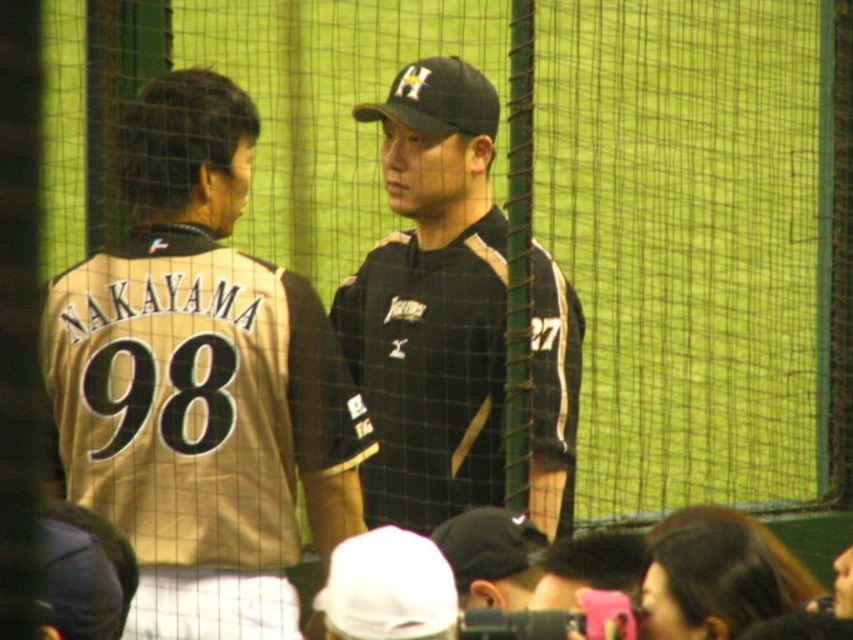
Is gold jersey at left thinner than black matte uniform at center?

No.

Consider the image. Is gold jersey at left wider than black matte uniform at center?

Yes.

Is point (141, 170) more distant than point (421, 294)?

No, (141, 170) is closer to viewer.

Find the location of a particular element. gold jersey at left is located at coordinates (201, 381).

Can you confirm if black matte uniform at center is smaller than black matte baseball cap at center?

Incorrect, black matte uniform at center is not smaller in size than black matte baseball cap at center.

The image size is (853, 640). Identify the location of black matte uniform at center. (431, 301).

You are a GUI agent. You are given a task and a screenshot of the screen. Output one action in this format:
    pyautogui.click(x=<x>, y=<y>)
    Task: Click on the black matte uniform at center
    
    Given the screenshot: What is the action you would take?
    pyautogui.click(x=431, y=301)

Does gold jersey at left have a larger size compared to black matte baseball cap at center?

Correct, gold jersey at left is larger in size than black matte baseball cap at center.

The height and width of the screenshot is (640, 853). What do you see at coordinates (201, 381) in the screenshot?
I see `gold jersey at left` at bounding box center [201, 381].

At what (x,y) coordinates should I click in order to perform the action: click on gold jersey at left. Please return your answer as a coordinate pair (x, y). The width and height of the screenshot is (853, 640). Looking at the image, I should click on (201, 381).